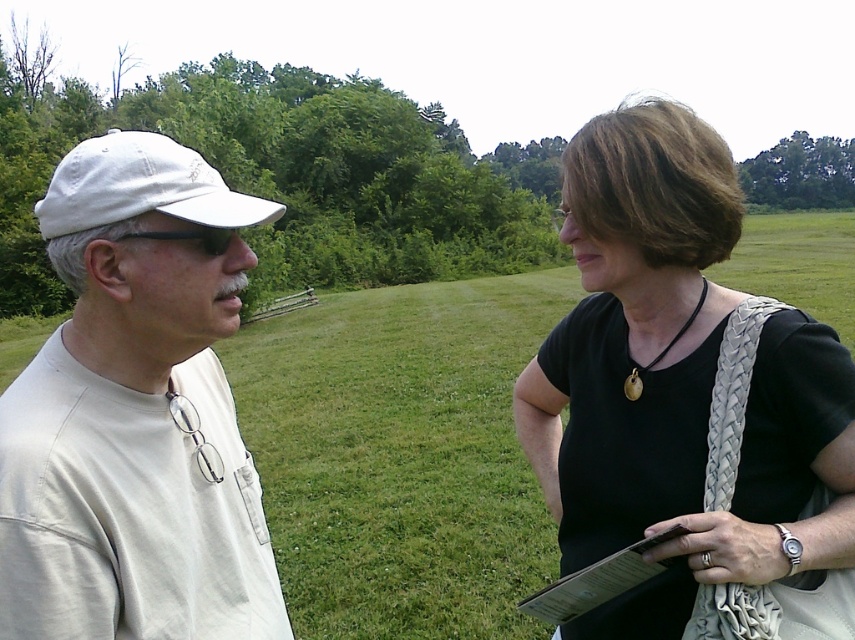
Question: Can you confirm if black woven purse at right is positioned to the left of white fabric baseball cap at left?

Choices:
 (A) no
 (B) yes

Answer: (A)

Question: Can you confirm if black woven purse at right is positioned to the right of white fabric baseball cap at left?

Choices:
 (A) yes
 (B) no

Answer: (A)

Question: Estimate the real-world distances between objects in this image. Which object is closer to the black woven purse at right?

Choices:
 (A) white matte cap at left
 (B) white fabric baseball cap at left

Answer: (A)

Question: Which point is farther to the camera?

Choices:
 (A) white fabric baseball cap at left
 (B) white matte cap at left

Answer: (A)

Question: Based on their relative distances, which object is nearer to the white fabric baseball cap at left?

Choices:
 (A) black woven purse at right
 (B) white matte cap at left

Answer: (B)

Question: Does white matte cap at left appear on the right side of white fabric baseball cap at left?

Choices:
 (A) no
 (B) yes

Answer: (B)